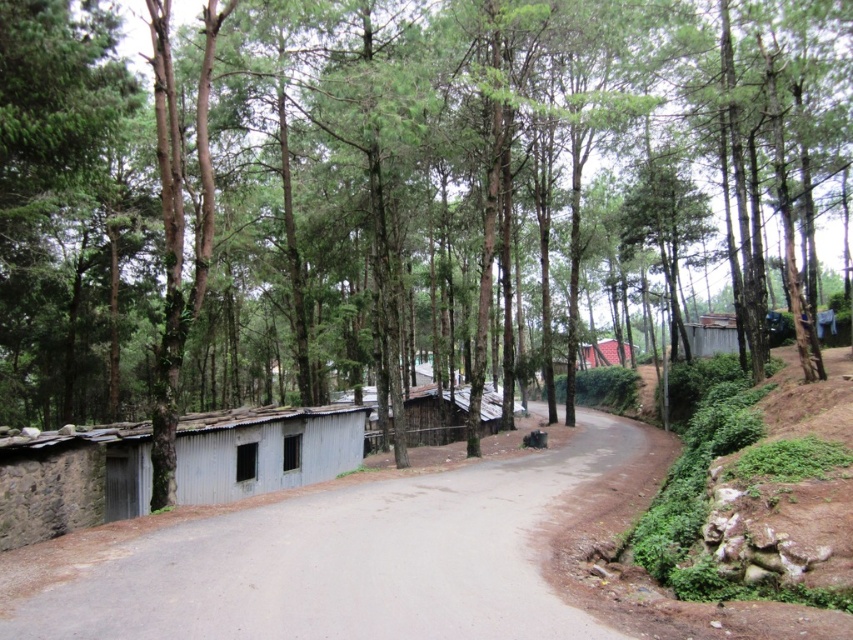
Which is above, gray concrete road at center or brown corrugated metal hut at center-right?

brown corrugated metal hut at center-right is higher up.

Measure the distance between gray concrete road at center and brown corrugated metal hut at center-right.

A distance of 55.02 meters exists between gray concrete road at center and brown corrugated metal hut at center-right.

Between point (474, 515) and point (583, 349), which one is positioned behind?

The point (583, 349) is behind.

Locate an element on the screen. Image resolution: width=853 pixels, height=640 pixels. gray concrete road at center is located at coordinates (363, 556).

Does metal corrugated hut at left have a lesser height compared to brown corrugated metal hut at center-right?

In fact, metal corrugated hut at left may be taller than brown corrugated metal hut at center-right.

Is metal corrugated hut at left to the left of brown corrugated metal hut at center-right from the viewer's perspective?

Correct, you'll find metal corrugated hut at left to the left of brown corrugated metal hut at center-right.

Locate an element on the screen. The image size is (853, 640). metal corrugated hut at left is located at coordinates (264, 449).

Does gray concrete road at center appear under metal corrugated hut at left?

Yes.

Locate an element on the screen. The image size is (853, 640). gray concrete road at center is located at coordinates (363, 556).

The width and height of the screenshot is (853, 640). Find the location of `gray concrete road at center`. gray concrete road at center is located at coordinates (363, 556).